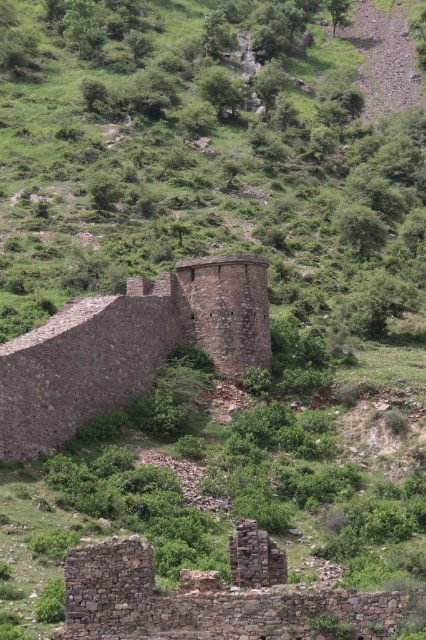
You are a hiker who wants to reach the brown stone wall at center from the rusty stone ruins at lower left. Which direction should you move relative to the ruins?

You should move upward from the rusty stone ruins at lower left to reach the brown stone wall at center since the brown stone wall at center is located above the rusty stone ruins at lower left.